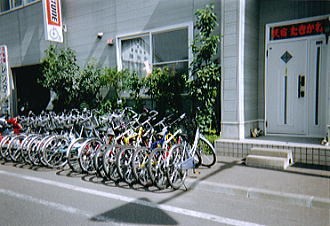
Locate an element on the screen. The height and width of the screenshot is (226, 330). windows is located at coordinates (127, 49), (172, 43), (6, 7), (17, 2), (30, 0).